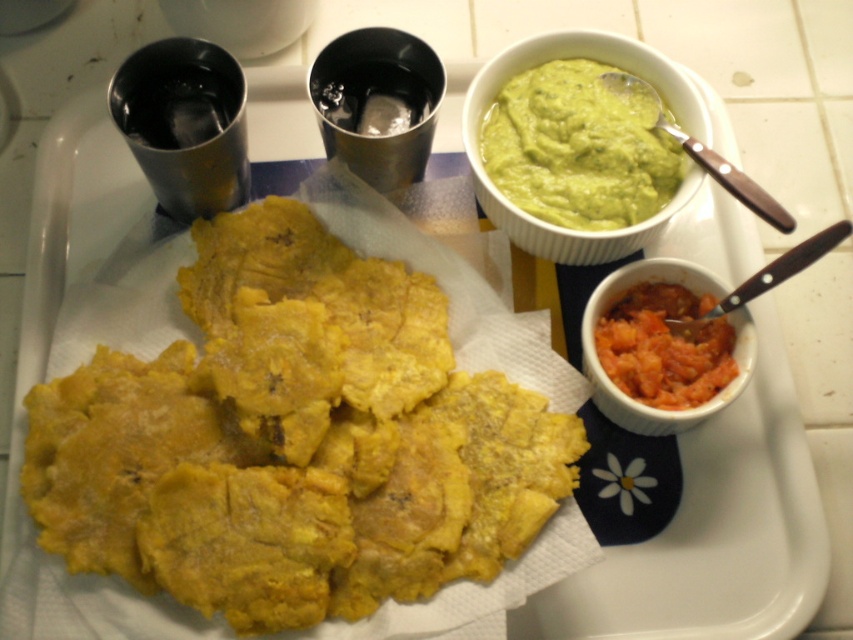
Question: In this image, where is green smooth guacamole at upper right located relative to smooth orange puree at lower right?

Choices:
 (A) left
 (B) right

Answer: (A)

Question: Estimate the real-world distances between objects in this image. Which object is closer to the smooth orange puree at lower right?

Choices:
 (A) yellow fried plantains at center
 (B) green smooth guacamole at upper right

Answer: (B)

Question: Is yellow fried plantains at center below green smooth guacamole at upper right?

Choices:
 (A) no
 (B) yes

Answer: (B)

Question: Which object appears farthest from the camera in this image?

Choices:
 (A) yellow fried plantains at center
 (B) green smooth guacamole at upper right

Answer: (B)

Question: Which object appears farthest from the camera in this image?

Choices:
 (A) yellow fried plantains at center
 (B) smooth orange puree at lower right
 (C) green smooth guacamole at upper right

Answer: (C)

Question: Can you confirm if yellow fried plantains at center is positioned above green smooth guacamole at upper right?

Choices:
 (A) yes
 (B) no

Answer: (B)